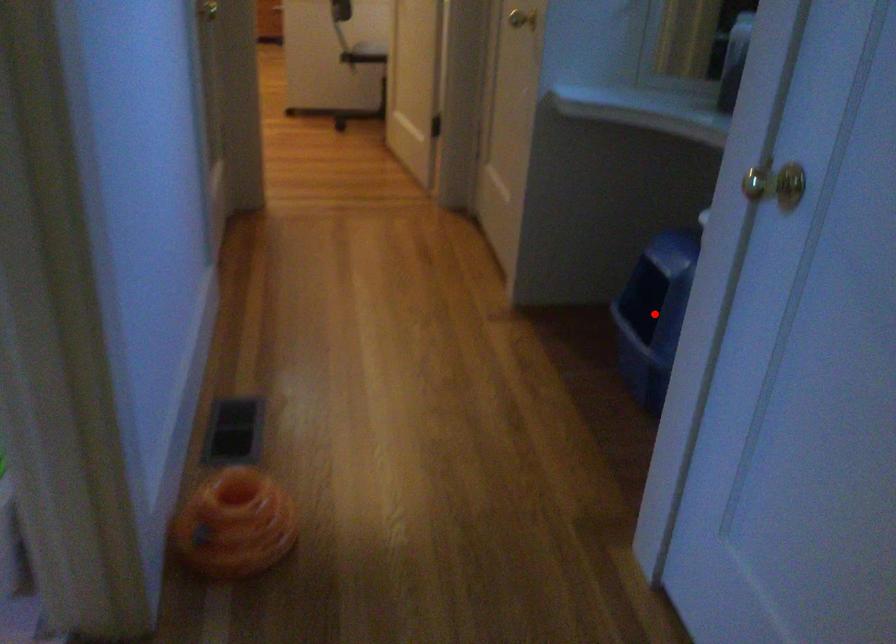
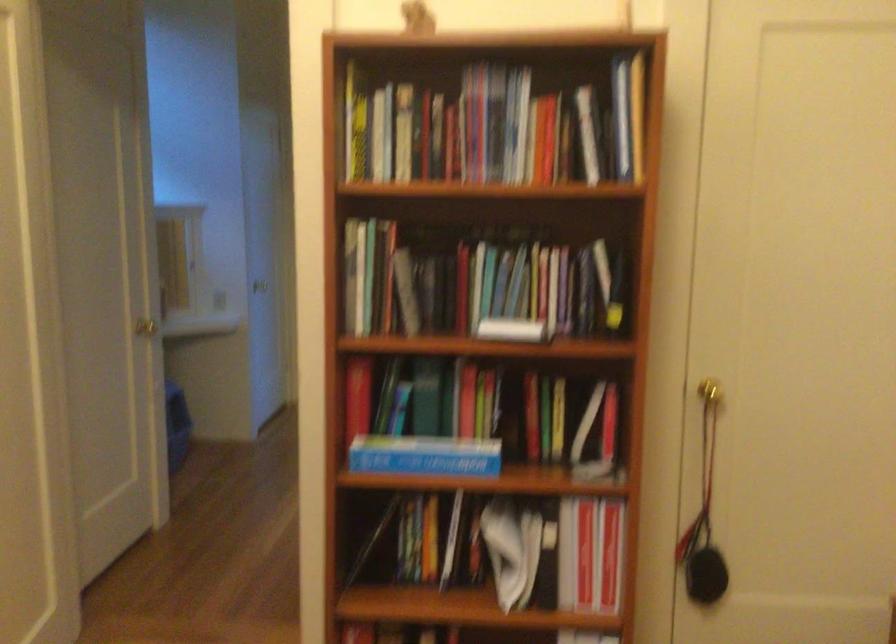
Question: I am providing you with two images of the same scene from different viewpoints. A red point is marked on the first image. Can you still see the location of the red point in image 2?

Choices:
 (A) Yes
 (B) No

Answer: (B)